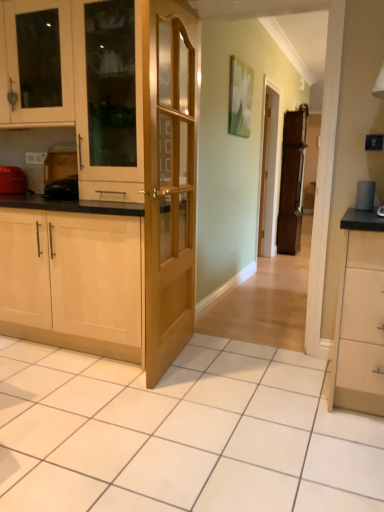
Question: Considering their positions, is white glossy cabinet at upper left, marked as the first cabinetry in a top-to-bottom arrangement, located in front of or behind brown wooden fridge at center?

Choices:
 (A) behind
 (B) front

Answer: (B)

Question: Considering the positions of white glossy cabinet at upper left, marked as the first cabinetry in a top-to-bottom arrangement, and brown wooden fridge at center in the image, is white glossy cabinet at upper left, marked as the first cabinetry in a top-to-bottom arrangement, wider or thinner than brown wooden fridge at center?

Choices:
 (A) wide
 (B) thin

Answer: (A)

Question: Which of these objects is positioned farthest from the matte red toaster at left?

Choices:
 (A) white glossy cabinet at upper left, marked as the first cabinetry in a top-to-bottom arrangement
 (B) light wood/wooden cabinet at left, the 3th cabinetry when ordered from top to bottom
 (C) brown wooden fridge at center
 (D) matte wooden screen door at center
 (E) matte wood cabinet at center, which is the 2th cabinetry from bottom to top

Answer: (C)

Question: Which of these objects is positioned farthest from the white glossy cabinet at upper left, which is the third cabinetry from bottom to top?

Choices:
 (A) light wood/wooden cabinet at left, which is the 1th cabinetry in bottom-to-top order
 (B) light wood/glass door at center
 (C) matte wooden screen door at center
 (D) matte red toaster at left
 (E) matte wood cabinet at center, which is the 2th cabinetry from bottom to top

Answer: (C)